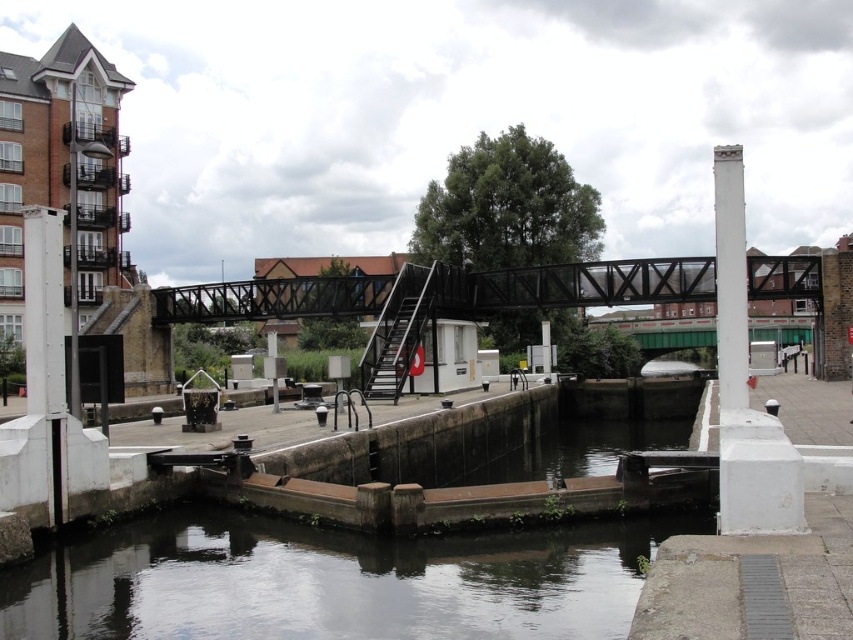
Is dark gray concrete river at lower center taller than black metal bridge at center?

Incorrect, dark gray concrete river at lower center's height is not larger of black metal bridge at center's.

What do you see at coordinates (331, 580) in the screenshot? This screenshot has height=640, width=853. I see `dark gray concrete river at lower center` at bounding box center [331, 580].

This screenshot has height=640, width=853. I want to click on dark gray concrete river at lower center, so click(x=331, y=580).

Which is above, dark gray concrete river at lower center or white concrete pillar at upper right?

white concrete pillar at upper right is above.

Which is in front, point (270, 552) or point (714, 220)?

Point (270, 552) is more forward.

Is point (125, 547) closer to camera compared to point (722, 394)?

No.

Locate an element on the screen. dark gray concrete river at lower center is located at coordinates (331, 580).

How much distance is there between black metal bridge at center and white concrete pillar at upper right?

The distance of black metal bridge at center from white concrete pillar at upper right is 96.04 feet.

From the picture: Is black metal bridge at center smaller than white concrete pillar at upper right?

Incorrect, black metal bridge at center is not smaller in size than white concrete pillar at upper right.

The image size is (853, 640). I want to click on black metal bridge at center, so click(442, 291).

The width and height of the screenshot is (853, 640). In order to click on black metal bridge at center in this screenshot , I will do `click(442, 291)`.